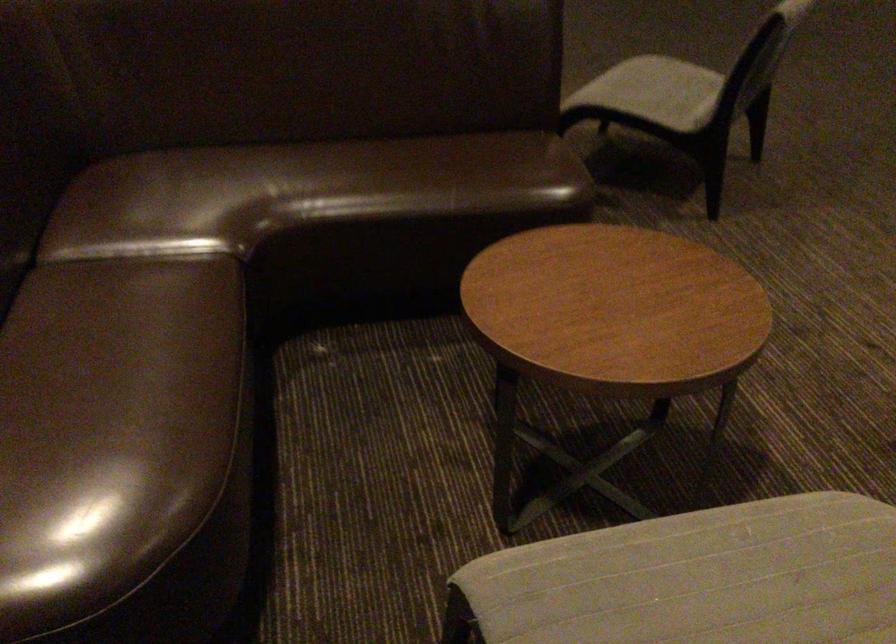
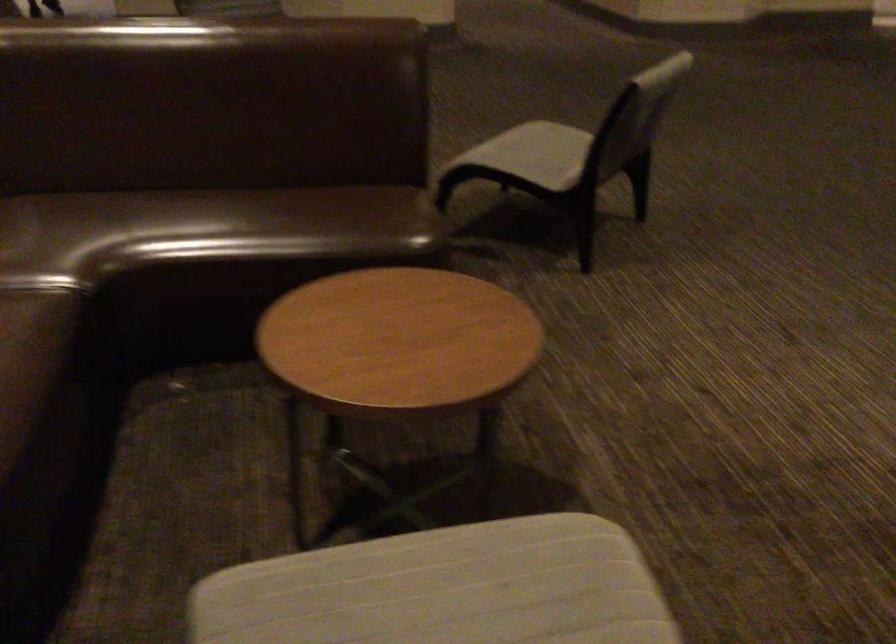
Locate, in the second image, the point that corresponds to the point at 713,574 in the first image.

(444, 589)